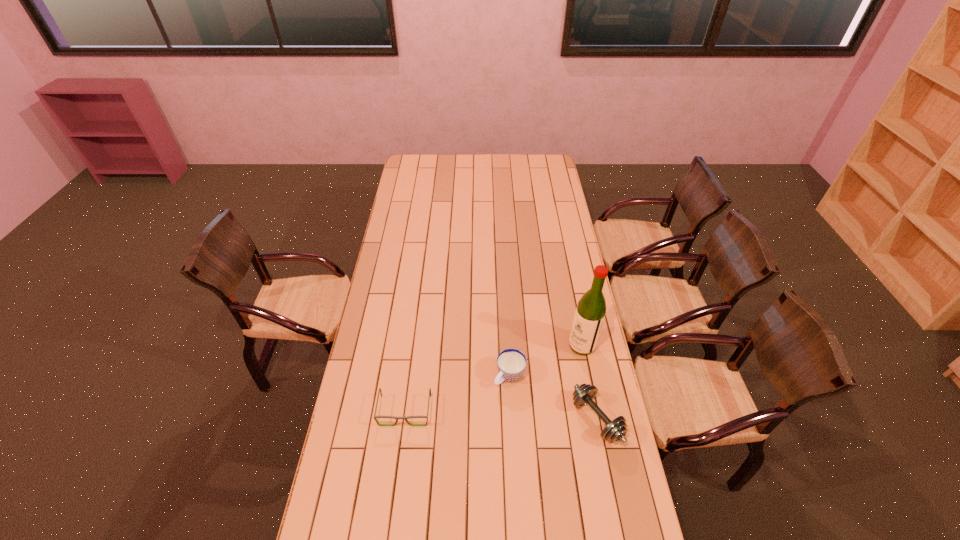
Find the location of a particular element. Image resolution: width=960 pixels, height=540 pixels. free spot on the desktop that is between the leftmost object and the dumbbell and is positioned on the label of the farthest object is located at coordinates [492, 415].

Image resolution: width=960 pixels, height=540 pixels. I want to click on vacant space on the desktop that is between the spectacles and the dumbbell and is positioned on the side of the cup with the handle, so click(471, 414).